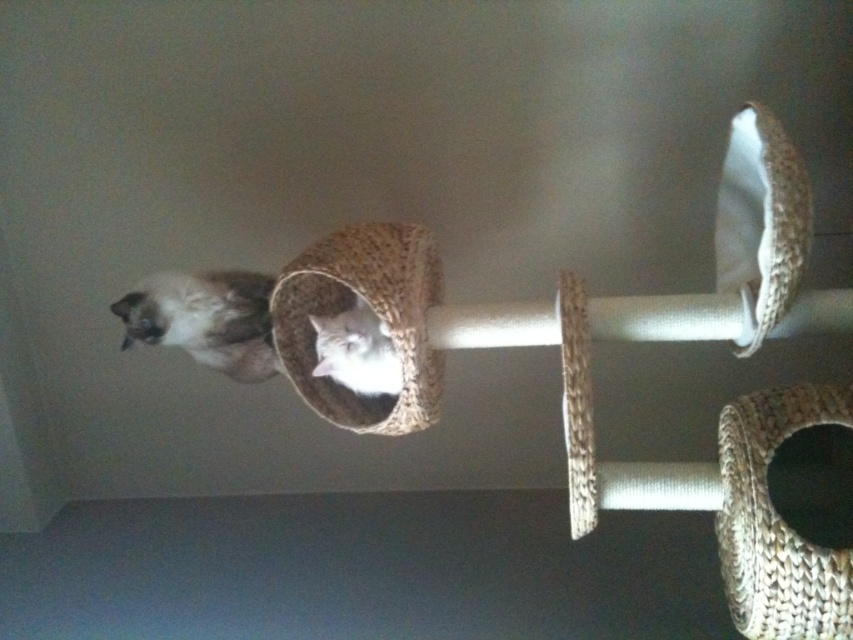
Question: Can you confirm if natural woven cat bed at center is positioned to the right of white soft cat at center?

Choices:
 (A) yes
 (B) no

Answer: (B)

Question: Does natural woven cat bed at center appear over white soft cat at center?

Choices:
 (A) yes
 (B) no

Answer: (A)

Question: Among these objects, which one is nearest to the camera?

Choices:
 (A) silky white cat at upper left
 (B) natural woven cat bed at center
 (C) white soft cat at center

Answer: (B)

Question: Which point is farther to the camera?

Choices:
 (A) (341, 349)
 (B) (293, 384)
 (C) (268, 365)

Answer: (C)

Question: Can you confirm if natural woven cat bed at center is thinner than silky white cat at upper left?

Choices:
 (A) yes
 (B) no

Answer: (B)

Question: Which of the following is the closest to the observer?

Choices:
 (A) natural woven cat bed at center
 (B) silky white cat at upper left
 (C) white soft cat at center

Answer: (A)